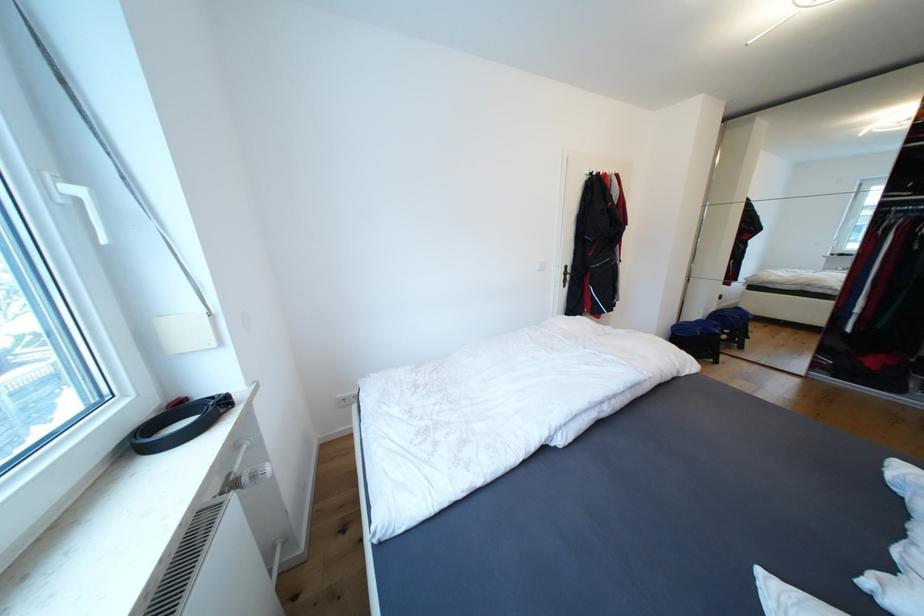
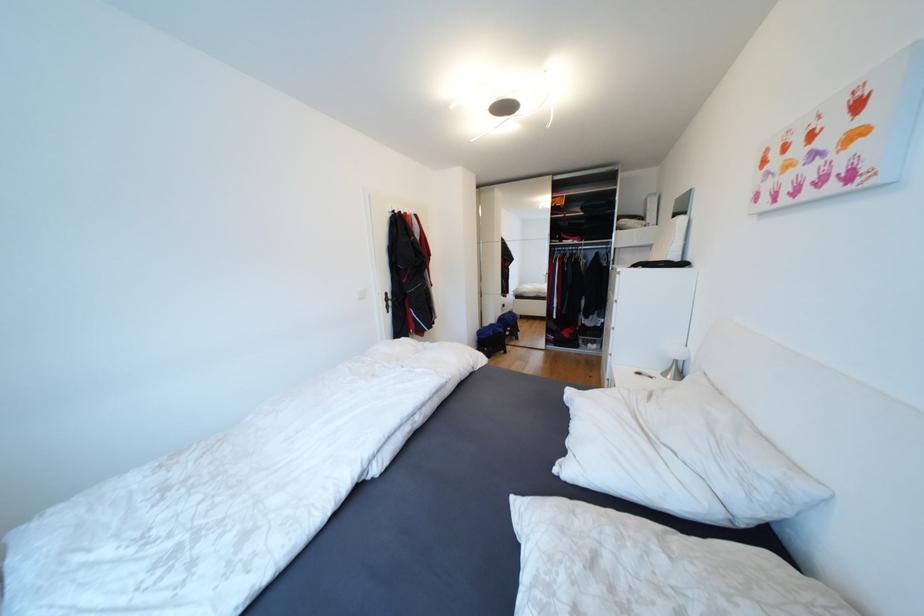
Where in the second image is the point corresponding to the point at 888,466 from the first image?

(570, 394)